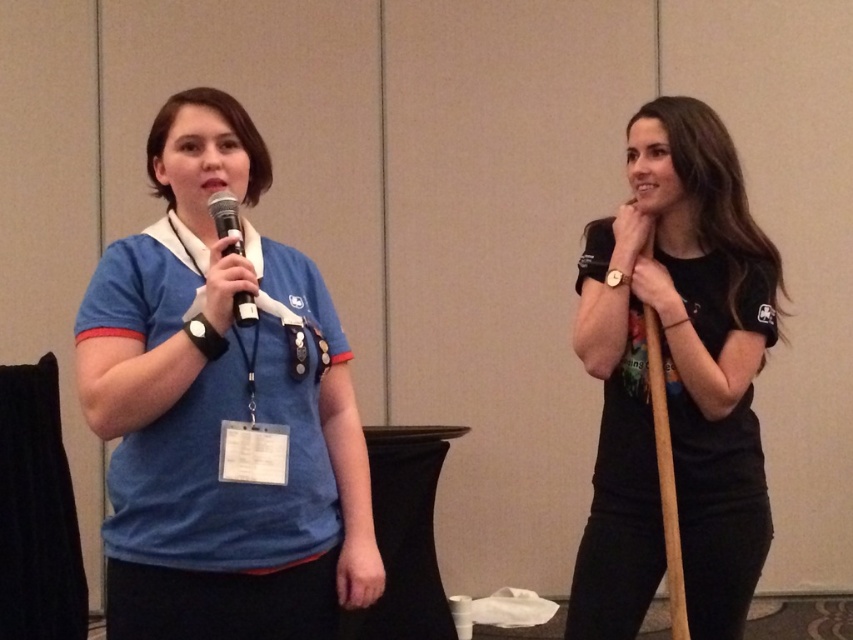
Question: Can you confirm if blue fabric shirt at left is bigger than matte black microphone at left?

Choices:
 (A) yes
 (B) no

Answer: (A)

Question: Can you confirm if blue fabric shirt at left is smaller than black matte shirt at right?

Choices:
 (A) yes
 (B) no

Answer: (B)

Question: Does black matte shirt at right have a smaller size compared to matte black microphone at left?

Choices:
 (A) no
 (B) yes

Answer: (A)

Question: Considering the real-world distances, which object is farthest from the matte black microphone at left?

Choices:
 (A) blue fabric shirt at left
 (B) black matte shirt at right

Answer: (B)

Question: Which of the following is the farthest from the observer?

Choices:
 (A) blue fabric shirt at left
 (B) matte black microphone at left
 (C) black matte shirt at right

Answer: (C)

Question: Estimate the real-world distances between objects in this image. Which object is closer to the blue fabric shirt at left?

Choices:
 (A) black matte shirt at right
 (B) matte black microphone at left

Answer: (B)